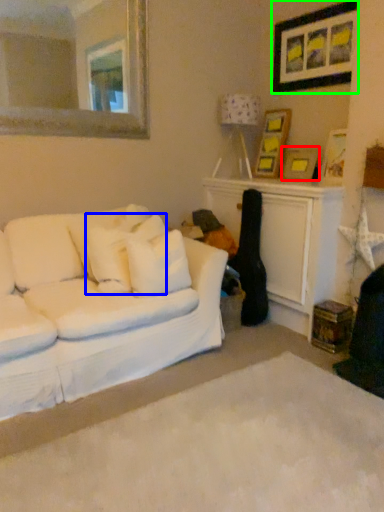
Question: Estimate the real-world distances between objects in this image. Which object is farther from picture frame (highlighted by a red box), pillow (highlighted by a blue box) or picture frame (highlighted by a green box)?

Choices:
 (A) pillow
 (B) picture frame

Answer: (A)